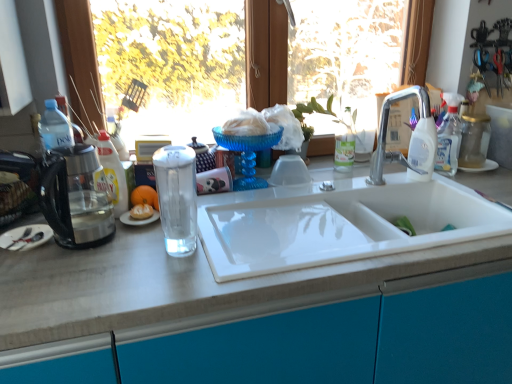
Identify the location of vacant area that lies between white glossy bottle at upper right and clear glass water at center. Image resolution: width=512 pixels, height=384 pixels. (277, 218).